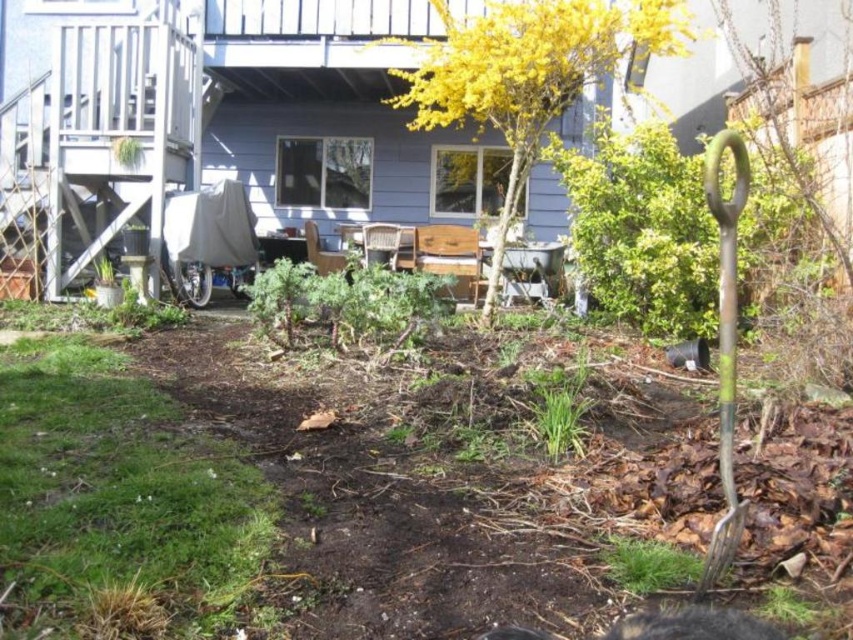
Does point (614, 13) come closer to viewer compared to point (730, 378)?

No, (614, 13) is behind (730, 378).

Between yellow leafy plant at upper center and rusty metal shovel at right, which one is positioned higher?

Positioned higher is yellow leafy plant at upper center.

Who is more forward, (517, 141) or (740, 212)?

Point (740, 212) is more forward.

You are a GUI agent. You are given a task and a screenshot of the screen. Output one action in this format:
    pyautogui.click(x=<x>, y=<y>)
    Task: Click on the yellow leafy plant at upper center
    The image size is (853, 640).
    Given the screenshot: What is the action you would take?
    pyautogui.click(x=527, y=74)